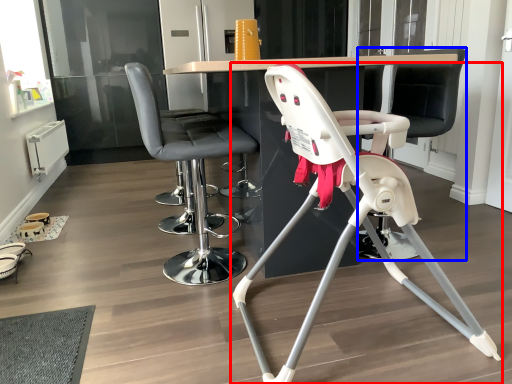
Question: Which of the following is the closest to the observer, chair (highlighted by a red box) or swivel chair (highlighted by a blue box)?

Choices:
 (A) chair
 (B) swivel chair

Answer: (A)